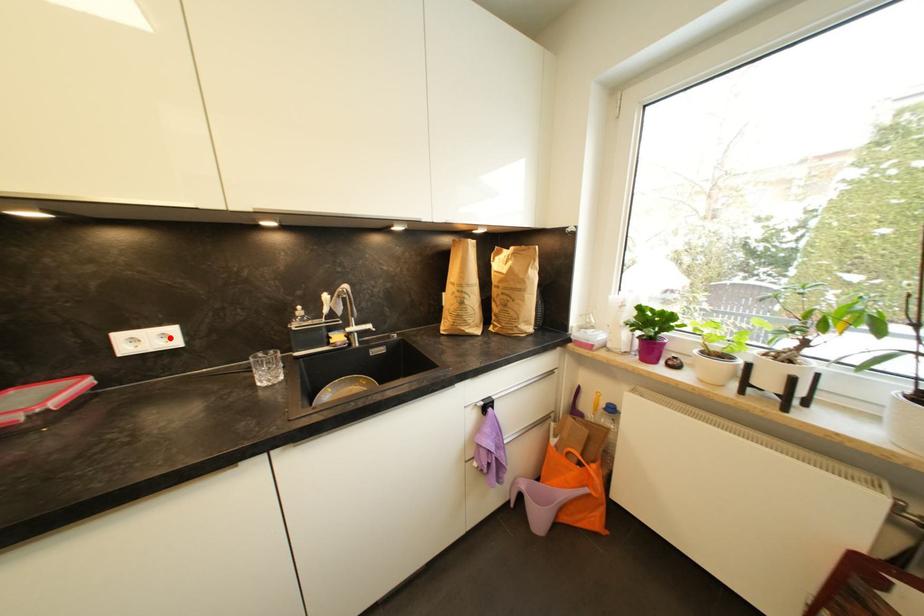
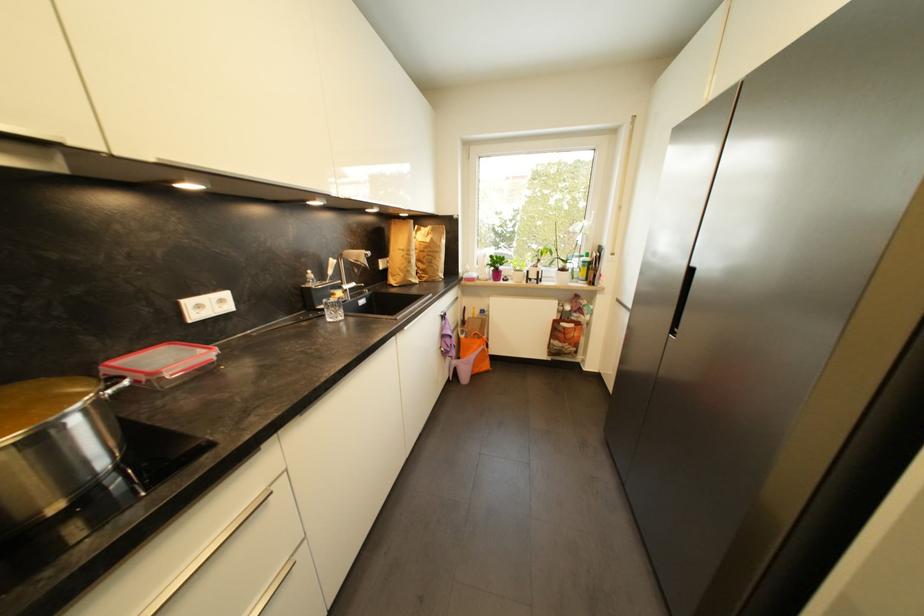
The point at the highlighted location is marked in the first image. Where is the corresponding point in the second image?

(226, 302)